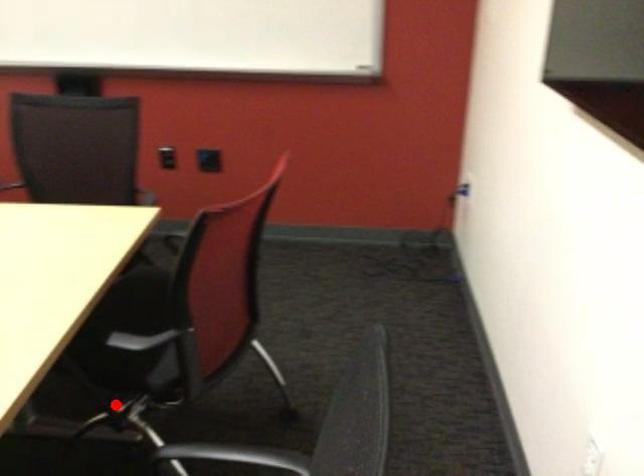
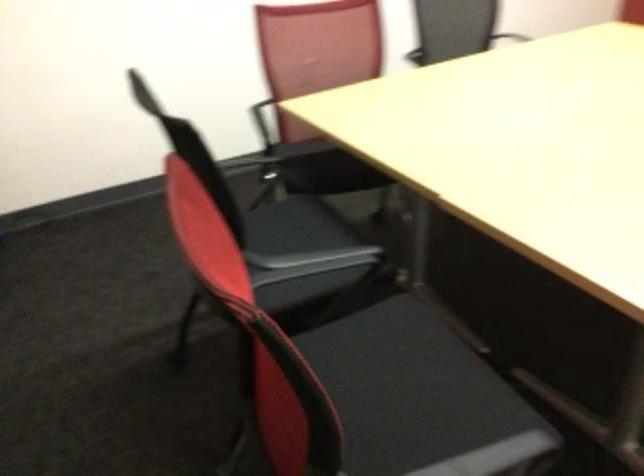
Question: I am providing you with two images of the same scene from different viewpoints. A red point is marked on the first image. At the location where the point appears in image 1, is it still visible in image 2?

Choices:
 (A) Yes
 (B) No

Answer: (B)